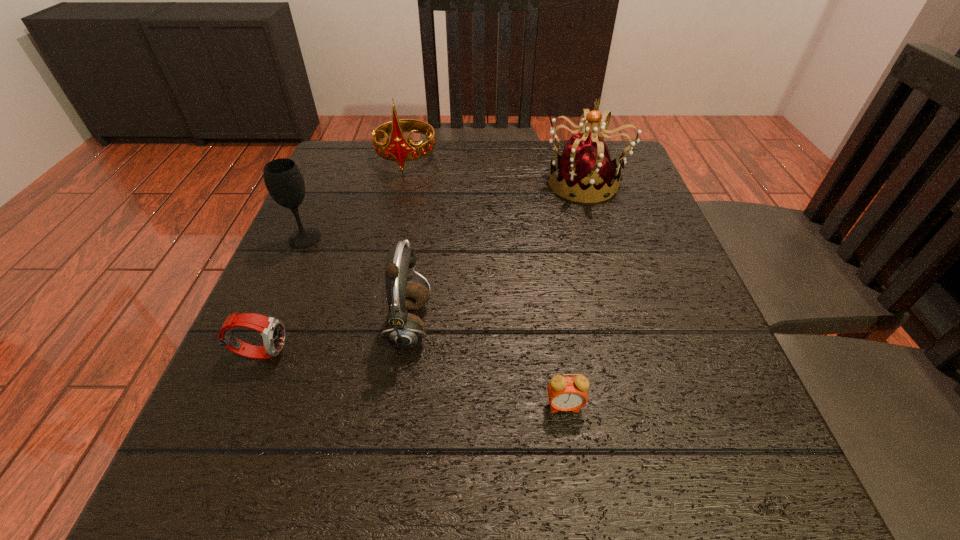
This screenshot has width=960, height=540. I want to click on the rightmost object, so click(x=585, y=171).

What are the coordinates of `the left tiara` in the screenshot? It's located at (398, 148).

You are a GUI agent. You are given a task and a screenshot of the screen. Output one action in this format:
    pyautogui.click(x=<x>, y=<y>)
    Task: Click on the earphone
    The image size is (960, 540).
    Given the screenshot: What is the action you would take?
    pyautogui.click(x=403, y=330)

Locate an element on the screen. Image resolution: width=960 pixels, height=540 pixels. the third farthest object is located at coordinates (284, 181).

Find the location of a particular element. Image resolution: width=960 pixels, height=540 pixels. watch is located at coordinates (272, 330).

Find the location of `alarm clock`. alarm clock is located at coordinates (565, 393).

Where is `the fifth object from left to right`? This screenshot has height=540, width=960. the fifth object from left to right is located at coordinates (565, 393).

What are the coordinates of `vacant area situated on the front-facing side of the rightmost object` in the screenshot? It's located at (375, 183).

Find the location of `blank area located 0.360m on the front-facing side of the rightmost object`. blank area located 0.360m on the front-facing side of the rightmost object is located at coordinates (392, 183).

Image resolution: width=960 pixels, height=540 pixels. Identify the location of free space located on the front-facing side of the rightmost object. (388, 183).